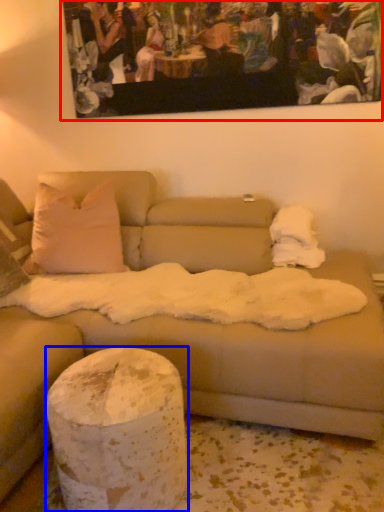
Question: Which object is further to the camera taking this photo, picture frame (highlighted by a red box) or pillar (highlighted by a blue box)?

Choices:
 (A) picture frame
 (B) pillar

Answer: (A)